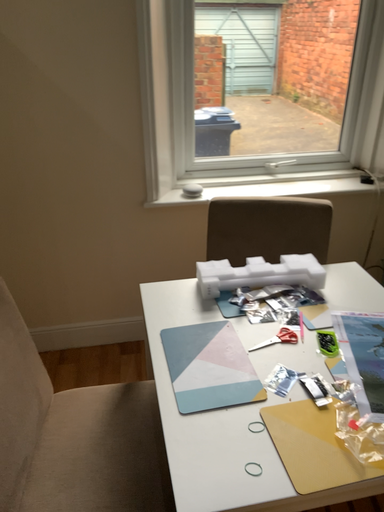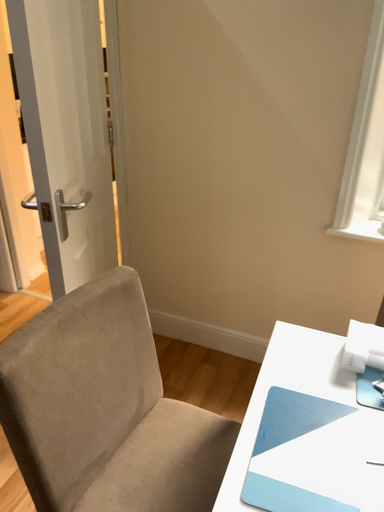
Question: Which way did the camera rotate in the video?

Choices:
 (A) rotated left
 (B) rotated right

Answer: (A)